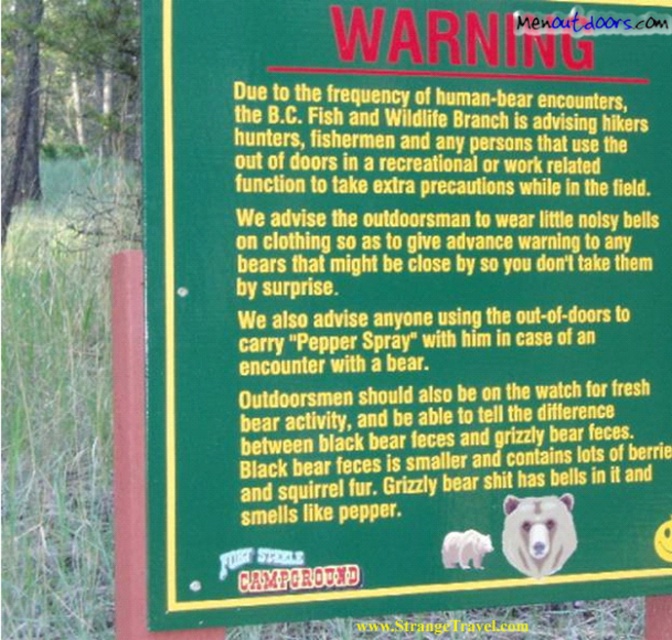
You are a hiker planning to take a photo of the warning sign. The sign has two bears depicted on it. Which bear, the brown furry bear at center or the white fur bear at lower center, is positioned higher on the sign?

The brown furry bear at center is positioned higher on the sign than the white fur bear at lower center because the brown furry bear at center is above the white fur bear at lower center.